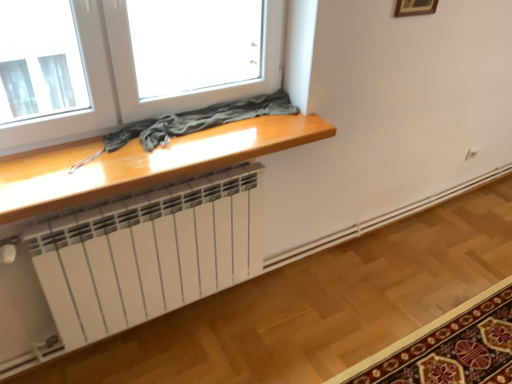
Question: Is carpet with floral pattern at lower right situated inside glossy wood table at upper center or outside?

Choices:
 (A) inside
 (B) outside

Answer: (B)

Question: Is carpet with floral pattern at lower right bigger or smaller than glossy wood table at upper center?

Choices:
 (A) big
 (B) small

Answer: (A)

Question: Which is nearer to the carpet with floral pattern at lower right?

Choices:
 (A) wooden picture frame at upper right
 (B) glossy wood table at upper center

Answer: (B)

Question: Which is farther from the wooden picture frame at upper right?

Choices:
 (A) glossy wood table at upper center
 (B) carpet with floral pattern at lower right

Answer: (B)